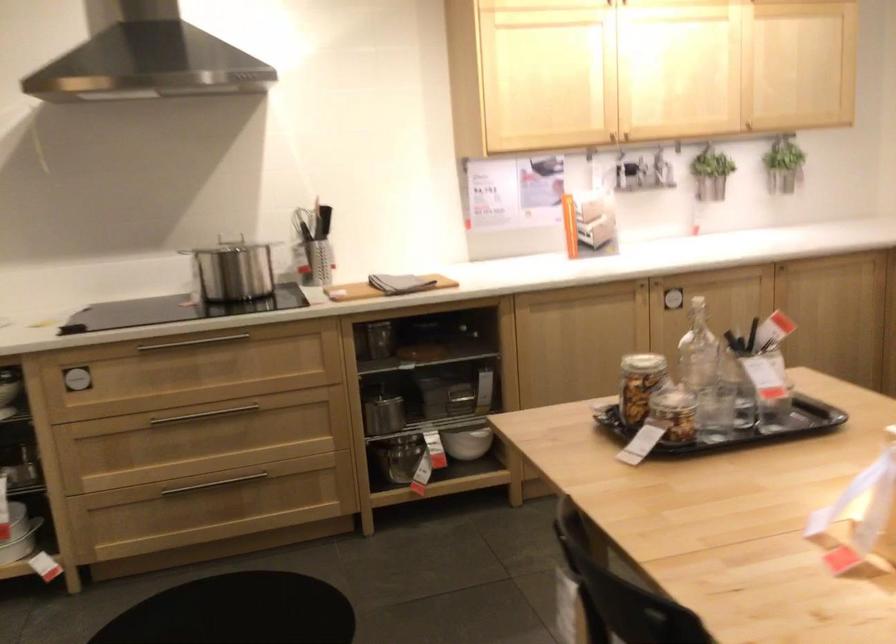
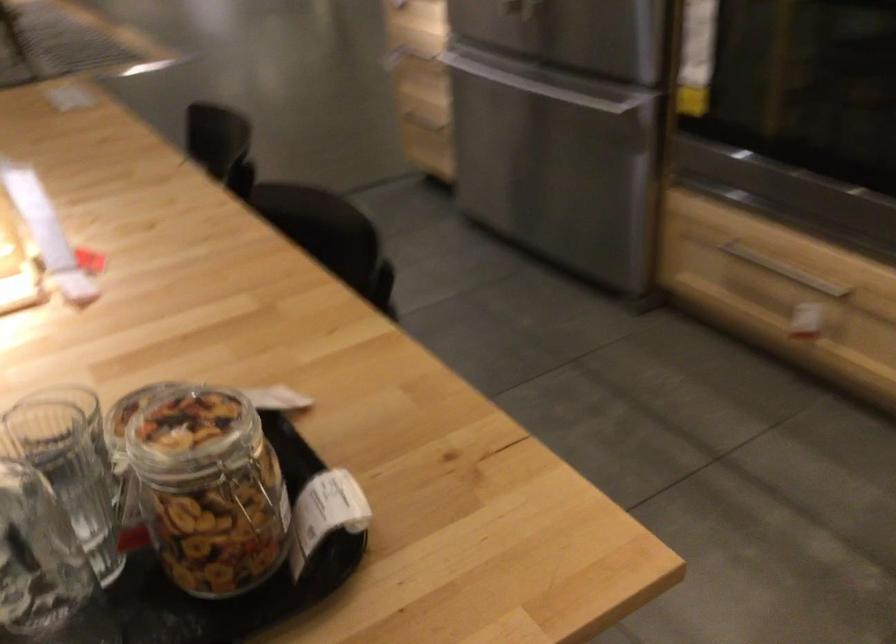
Locate, in the second image, the point that corresponds to (596,433) in the first image.

(293, 453)